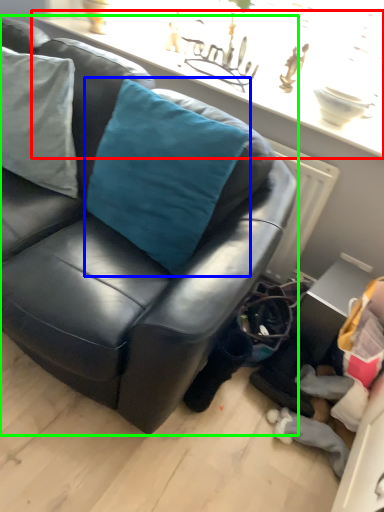
Question: Which object is the farthest from window sill (highlighted by a red box)? Choose among these: throw pillow (highlighted by a blue box) or studio couch (highlighted by a green box).

Choices:
 (A) throw pillow
 (B) studio couch

Answer: (B)